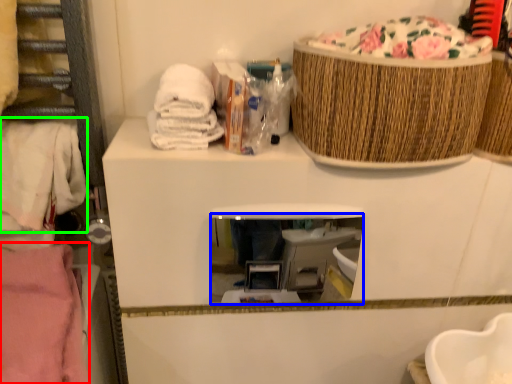
Question: Considering the real-world distances, which object is farthest from clothing (highlighted by a red box)? mirror (highlighted by a blue box) or clothing (highlighted by a green box)?

Choices:
 (A) mirror
 (B) clothing

Answer: (A)